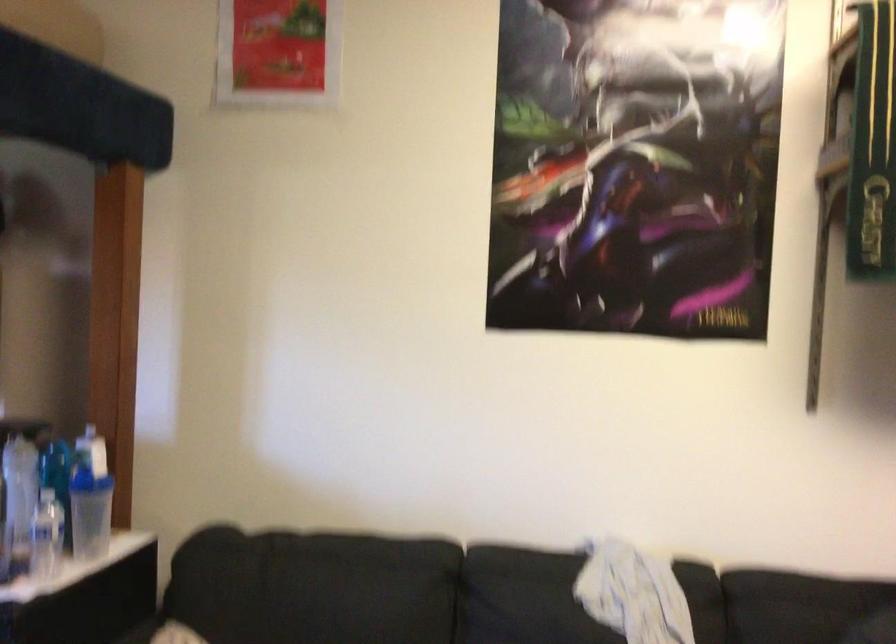
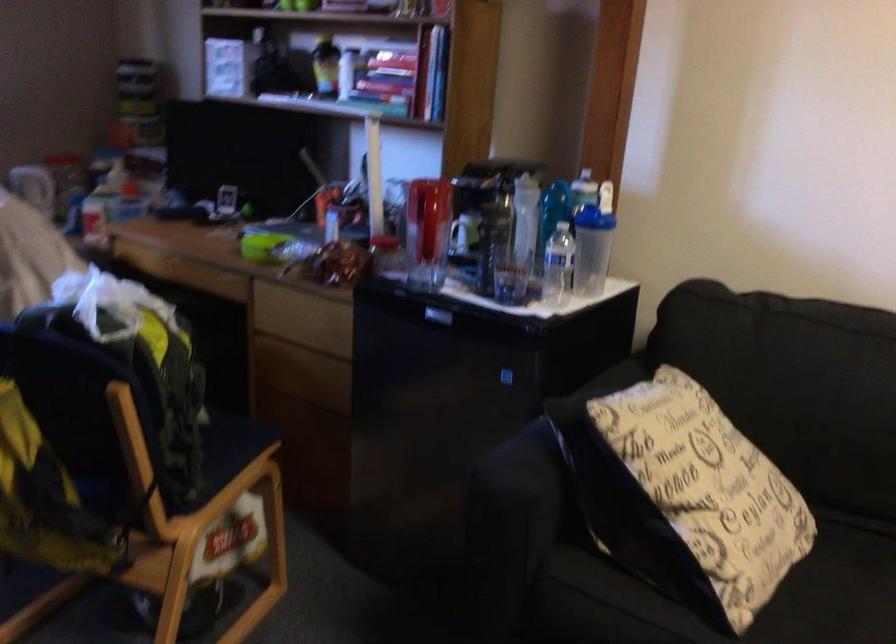
Find the pixel in the second image that matches point (90, 513) in the first image.

(591, 250)